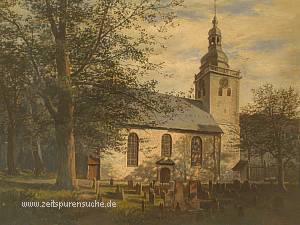
Image resolution: width=300 pixels, height=225 pixels. What are the coordinates of `left window` in the screenshot? It's located at (137, 152).